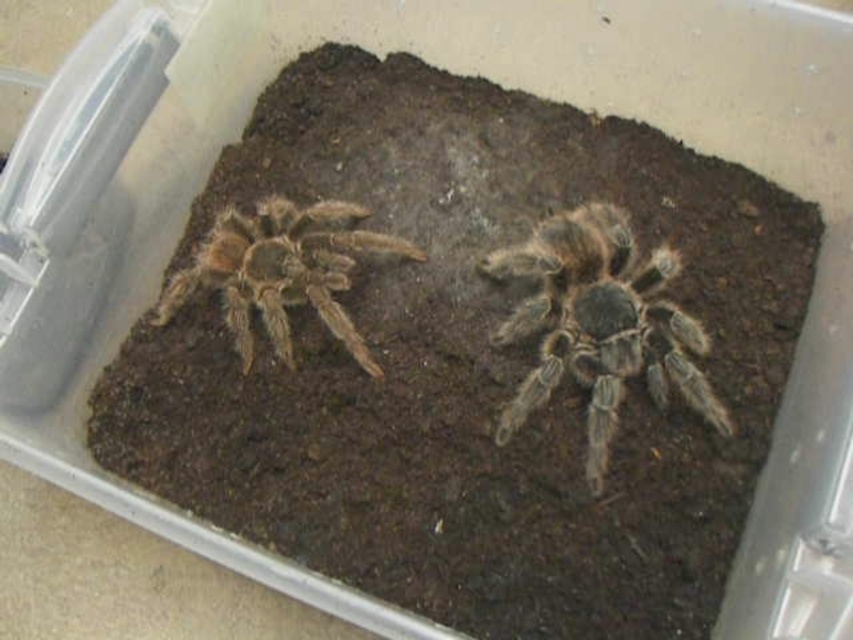
You are observing two tarantulas in a terrarium. You see a fuzzy brown spider at center and a brown fuzzy spider at left. Which one is positioned closer to the front of the container?

The fuzzy brown spider at center is closer to the viewer than the brown fuzzy spider at left, so the fuzzy brown spider at center is positioned closer to the front of the container.

You are an arachnologist observing two tarantulas in a terrarium. You notice a fuzzy brown spider at center and a brown fuzzy spider at left. Which spider is positioned lower in the container?

The fuzzy brown spider at center is located below the brown fuzzy spider at left, so it is positioned lower in the container.